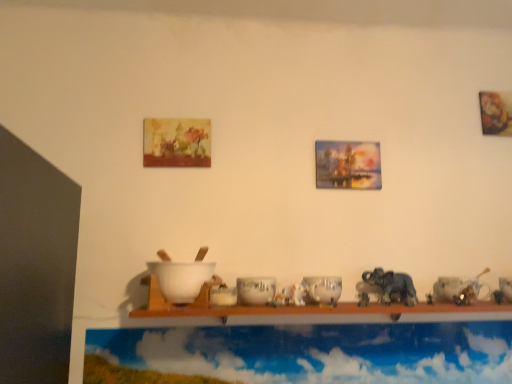
Question: Should I look upward or downward to see white glossy bowl at center, which is the 2th tableware in left-to-right order?

Choices:
 (A) up
 (B) down

Answer: (B)

Question: Is white glossy bowl at center, the fourth tableware from the left, completely or partially outside of white matte mixing bowl at center?

Choices:
 (A) no
 (B) yes

Answer: (B)

Question: Is white glossy bowl at center, the fourth tableware from the left, touching white matte mixing bowl at center?

Choices:
 (A) no
 (B) yes

Answer: (A)

Question: Are white glossy bowl at center, which appears as the first tableware when viewed from the right, and white matte mixing bowl at center located far from each other?

Choices:
 (A) yes
 (B) no

Answer: (A)

Question: From the image's perspective, is white glossy bowl at center, the fourth tableware from the left, above white matte mixing bowl at center?

Choices:
 (A) no
 (B) yes

Answer: (A)

Question: Considering the relative sizes of white glossy bowl at center, which appears as the first tableware when viewed from the right, and white matte mixing bowl at center in the image provided, is white glossy bowl at center, which appears as the first tableware when viewed from the right, taller than white matte mixing bowl at center?

Choices:
 (A) no
 (B) yes

Answer: (A)

Question: Considering the relative sizes of white glossy bowl at center, the fourth tableware from the left, and white matte mixing bowl at center in the image provided, is white glossy bowl at center, the fourth tableware from the left, thinner than white matte mixing bowl at center?

Choices:
 (A) no
 (B) yes

Answer: (B)

Question: Would you say matte wooden picture frame at upper center, the first picture frame positioned from the left, is part of white glossy bowl at center, which ranks as the 1th tableware in left-to-right order,'s contents?

Choices:
 (A) yes
 (B) no

Answer: (B)

Question: Is white glossy bowl at center, which ranks as the 1th tableware in left-to-right order, facing towards matte wooden picture frame at upper center, marked as the 2th picture frame in a right-to-left arrangement?

Choices:
 (A) yes
 (B) no

Answer: (B)

Question: Is there a large distance between white glossy bowl at center, the fourth tableware positioned from the right, and matte wooden picture frame at upper center, the first picture frame positioned from the left?

Choices:
 (A) yes
 (B) no

Answer: (B)

Question: Can we say white glossy bowl at center, which ranks as the 1th tableware in left-to-right order, lies outside matte wooden picture frame at upper center, marked as the 2th picture frame in a right-to-left arrangement?

Choices:
 (A) yes
 (B) no

Answer: (A)

Question: Considering the relative sizes of white glossy bowl at center, which ranks as the 1th tableware in left-to-right order, and matte wooden picture frame at upper center, marked as the 2th picture frame in a right-to-left arrangement, in the image provided, is white glossy bowl at center, which ranks as the 1th tableware in left-to-right order, shorter than matte wooden picture frame at upper center, marked as the 2th picture frame in a right-to-left arrangement,?

Choices:
 (A) no
 (B) yes

Answer: (B)

Question: Is white glossy bowl at center, which ranks as the 1th tableware in left-to-right order, touching matte wooden picture frame at upper center, marked as the 2th picture frame in a right-to-left arrangement?

Choices:
 (A) no
 (B) yes

Answer: (A)

Question: Is white glossy bowl at center, arranged as the third tableware when viewed from the right, positioned in front of cloudy sky at upper center?

Choices:
 (A) no
 (B) yes

Answer: (B)